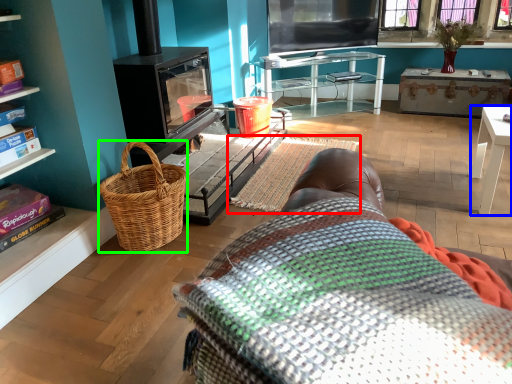
Question: Which is farther away from blanket (highlighted by a red box)? table (highlighted by a blue box) or picnic basket (highlighted by a green box)?

Choices:
 (A) table
 (B) picnic basket

Answer: (A)